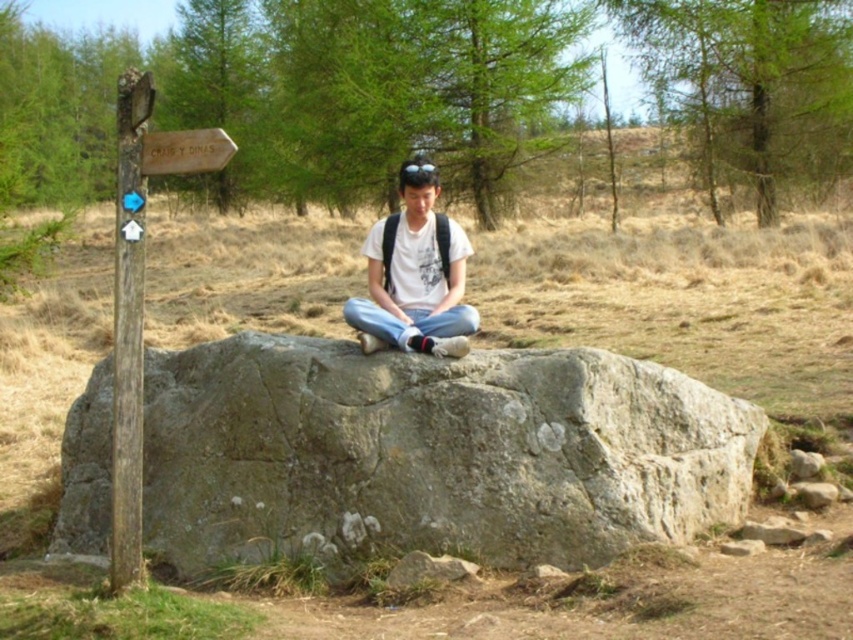
Question: Which of the following is the farthest from the observer?

Choices:
 (A) gray rough boulder at center
 (B) wooden post at left

Answer: (A)

Question: Which is nearer to the white matte t-shirt at center?

Choices:
 (A) gray rough boulder at center
 (B) wooden post at left

Answer: (A)

Question: Which object is the farthest from the white matte t-shirt at center?

Choices:
 (A) wooden post at left
 (B) gray rough boulder at center

Answer: (A)

Question: Can you confirm if gray rough boulder at center is wider than white matte t-shirt at center?

Choices:
 (A) no
 (B) yes

Answer: (B)

Question: Is gray rough boulder at center positioned before white matte t-shirt at center?

Choices:
 (A) yes
 (B) no

Answer: (A)

Question: Can you confirm if white matte t-shirt at center is positioned above wooden post at left?

Choices:
 (A) no
 (B) yes

Answer: (B)